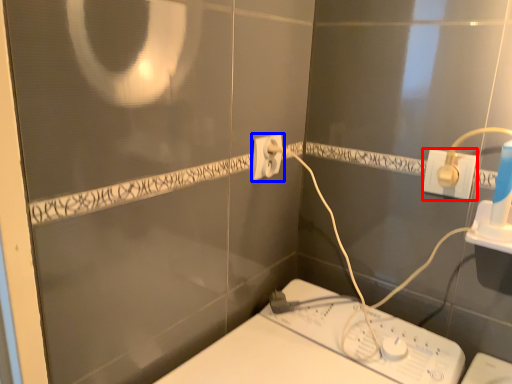
Question: Which object is closer to the camera taking this photo, power plugs and sockets (highlighted by a red box) or power plugs and sockets (highlighted by a blue box)?

Choices:
 (A) power plugs and sockets
 (B) power plugs and sockets

Answer: (A)